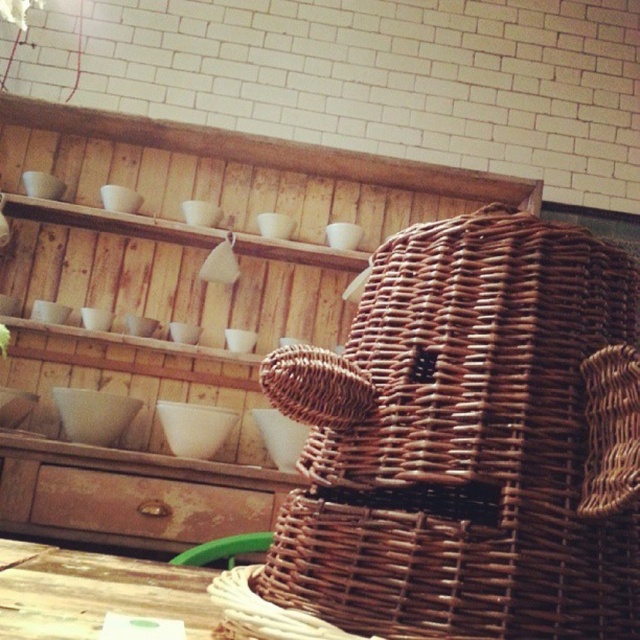
Can you confirm if wooden table at lower left is positioned to the right of rusty wood drawer at lower left?

Yes, wooden table at lower left is to the right of rusty wood drawer at lower left.

Is point (116, 568) closer to camera compared to point (252, 518)?

That is True.

Does point (26, 545) come farther from viewer compared to point (72, 493)?

No, (26, 545) is closer to viewer.

Where is `wooden table at lower left`? Image resolution: width=640 pixels, height=640 pixels. wooden table at lower left is located at coordinates (93, 593).

Measure the distance between brown wicker basket at center and rusty wood drawer at lower left.

They are 1.85 meters apart.

Is brown wicker basket at center further to camera compared to rusty wood drawer at lower left?

No, brown wicker basket at center is in front of rusty wood drawer at lower left.

You are a GUI agent. You are given a task and a screenshot of the screen. Output one action in this format:
    pyautogui.click(x=<x>, y=<y>)
    Task: Click on the brown wicker basket at center
    The height and width of the screenshot is (640, 640).
    Given the screenshot: What is the action you would take?
    pyautogui.click(x=461, y=442)

The image size is (640, 640). Identify the location of brown wicker basket at center. (461, 442).

Is brown wicker basket at center wider than wooden table at lower left?

No.

Can you confirm if brown wicker basket at center is shorter than wooden table at lower left?

Incorrect, brown wicker basket at center's height does not fall short of wooden table at lower left's.

Does point (493, 506) come behind point (131, 580)?

That is False.

This screenshot has height=640, width=640. What are the coordinates of `brown wicker basket at center` in the screenshot? It's located at (461, 442).